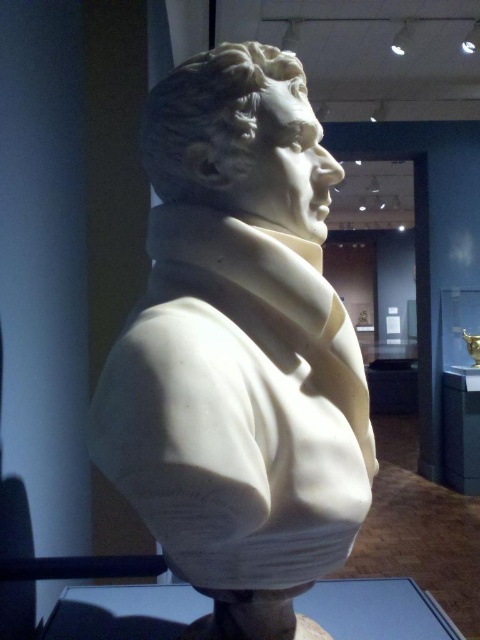
Question: Which point appears closest to the camera in this image?

Choices:
 (A) (295, 68)
 (B) (303, 596)

Answer: (A)

Question: Is white marble bust at center thinner than transparent glass table at lower center?

Choices:
 (A) no
 (B) yes

Answer: (B)

Question: Is white marble bust at center further to the viewer compared to transparent glass table at lower center?

Choices:
 (A) yes
 (B) no

Answer: (B)

Question: Which object appears farthest from the camera in this image?

Choices:
 (A) white marble bust at center
 (B) transparent glass table at lower center

Answer: (B)

Question: Which point appears farthest from the camera in this image?

Choices:
 (A) (207, 387)
 (B) (397, 579)

Answer: (B)

Question: Can you confirm if white marble bust at center is bigger than transparent glass table at lower center?

Choices:
 (A) no
 (B) yes

Answer: (B)